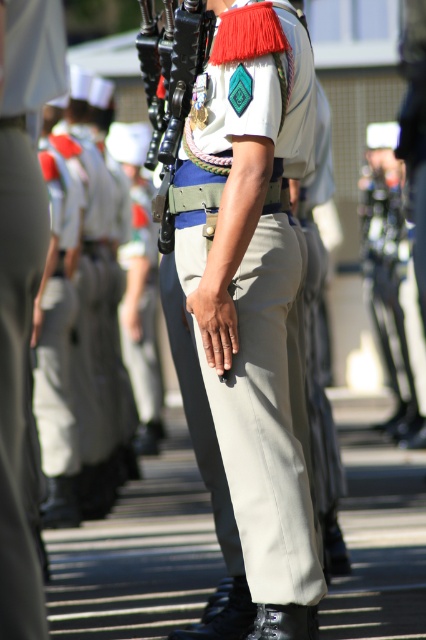
You are observing a military parade and notice two points marked on the soldier in the foreground. The first point is at coordinates point (2, 365) and the second at point (51, 172). Which of these points is nearer to your viewpoint?

Point (2, 365) is closer to the camera than point (51, 172).

You are an observer at the military parade. You notice the matte khaki pants at center and the matte black rifle at center. Which object appears shorter in the image?

The matte khaki pants at center is shorter than the matte black rifle at center.